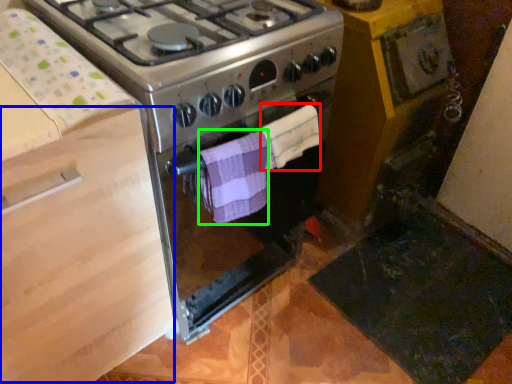
Question: Based on their relative distances, which object is farther from towel/napkin (highlighted by a red box)? Choose from drawer (highlighted by a blue box) and towel/napkin (highlighted by a green box).

Choices:
 (A) drawer
 (B) towel/napkin

Answer: (A)